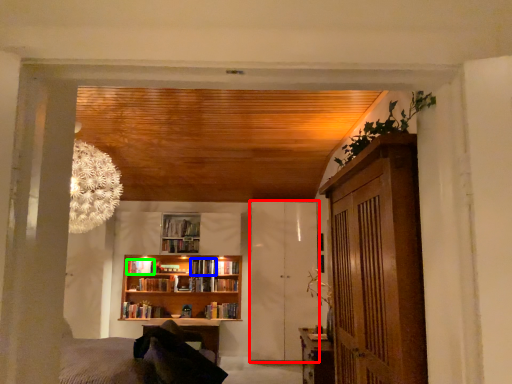
Question: Based on their relative distances, which object is nearer to barn door (highlighted by a red box)? Choose from book (highlighted by a blue box) and book (highlighted by a green box).

Choices:
 (A) book
 (B) book

Answer: (A)